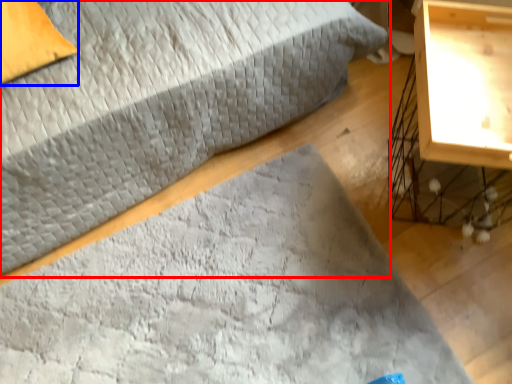
Question: Among these objects, which one is farthest to the camera, bed (highlighted by a red box) or pillow (highlighted by a blue box)?

Choices:
 (A) bed
 (B) pillow

Answer: (B)